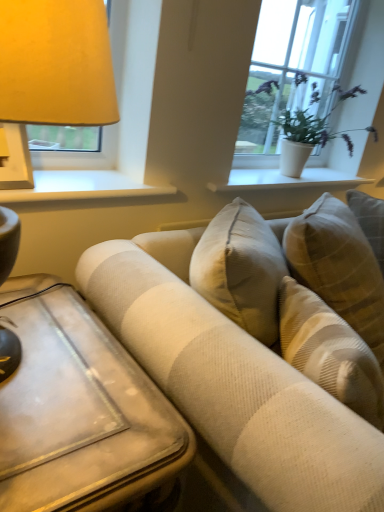
Question: Considering the positions of wooden table at lower left and beige textured couch at center in the image, is wooden table at lower left bigger or smaller than beige textured couch at center?

Choices:
 (A) big
 (B) small

Answer: (B)

Question: Is wooden table at lower left wider or thinner than beige textured couch at center?

Choices:
 (A) thin
 (B) wide

Answer: (A)

Question: Estimate the real-world distances between objects in this image. Which object is closer to the white ceramic vase at upper center, the 2th window sill viewed from the front?

Choices:
 (A) wooden table at lower left
 (B) white textured plant at upper right
 (C) white painted wood at upper left, arranged as the first window sill when viewed from the left
 (D) beige textured couch at center

Answer: (B)

Question: Which object is the closest to the beige textured couch at center?

Choices:
 (A) wooden table at lower left
 (B) white textured plant at upper right
 (C) white ceramic vase at upper center, the 2th window sill viewed from the front
 (D) white painted wood at upper left, arranged as the first window sill when viewed from the left

Answer: (A)